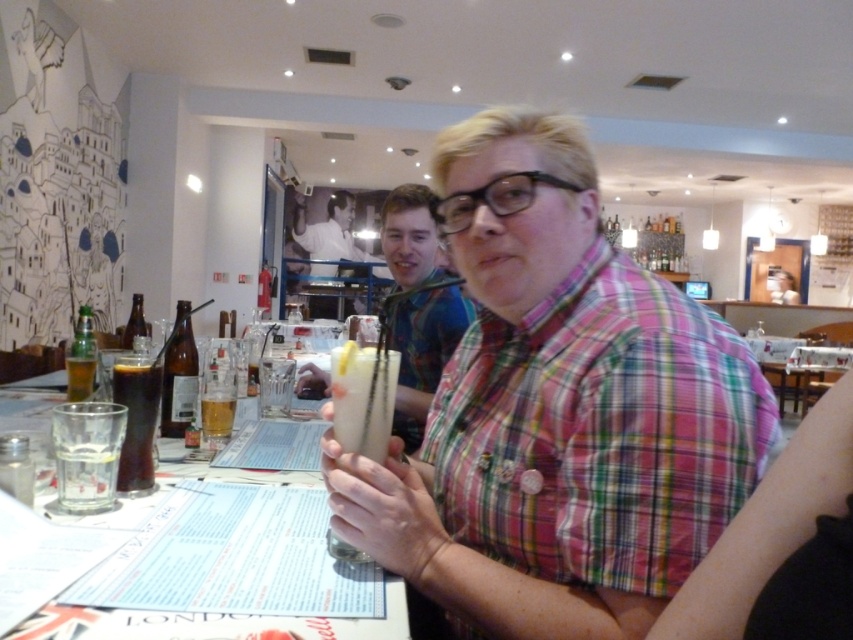
You are a customer in the restaurant and want to grab the translucent glass bottle at left and the brown glass bottle at center. Based on their positions, which one is closer to your right hand if you are sitting at the table?

The translucent glass bottle at left is to the right of the brown glass bottle at center, so if you are sitting at the table, the translucent glass bottle at left would be closer to your right hand.

You are a waiter in a restaurant and need to place a new drink order on the table. The table has limited space. There is a clear glass at lower left marked by point (86,476). Where should you place the new drink to avoid overlapping with existing items?

Place the new drink away from the clear glass at lower left marked by point (86,476) to avoid overlapping.

You are a waiter in a restaurant and need to place a new order of drinks on the table. The table already has a clear glass at lower left and a green glass bottle at left. Which object takes up more space on the table?

The green glass bottle at left occupies more space than the clear glass at lower left according to the description.